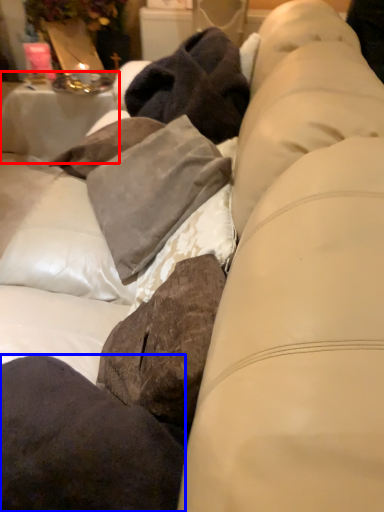
Question: Which object appears farthest to the camera in this image, table (highlighted by a red box) or pillow (highlighted by a blue box)?

Choices:
 (A) table
 (B) pillow

Answer: (A)